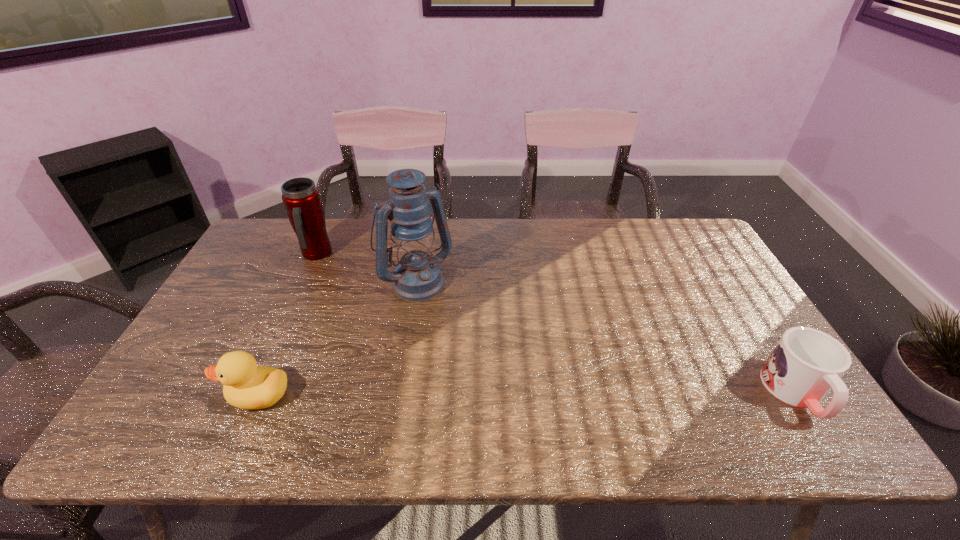
The image size is (960, 540). In order to click on free space on the desktop that is between the duck and the mug and is positioned on the front-facing side of the tallest object in this screenshot , I will do `click(513, 394)`.

Locate an element on the screen. Image resolution: width=960 pixels, height=540 pixels. vacant spot on the desktop that is between the duck and the rightmost object and is positioned on the side with the handle of the thermos bottle is located at coordinates (475, 394).